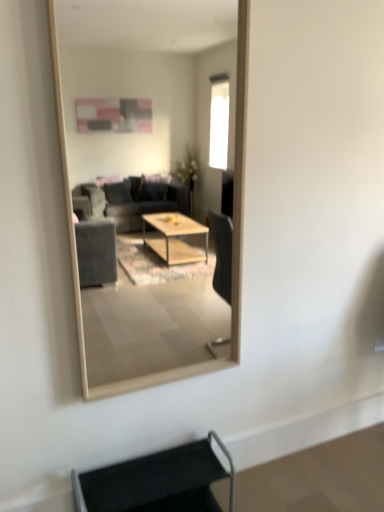
Question: From a real-world perspective, is black fabric armchair at lower center physically located above or below wooden frame mirror at center?

Choices:
 (A) below
 (B) above

Answer: (A)

Question: Does point (147, 487) appear closer or farther from the camera than point (84, 296)?

Choices:
 (A) farther
 (B) closer

Answer: (B)

Question: Relative to wooden frame mirror at center, is black fabric armchair at lower center in front or behind?

Choices:
 (A) behind
 (B) front

Answer: (A)

Question: Based on their positions, is wooden frame mirror at center located to the left or right of black fabric armchair at lower center?

Choices:
 (A) left
 (B) right

Answer: (B)

Question: In the image, is wooden frame mirror at center positioned in front of or behind black fabric armchair at lower center?

Choices:
 (A) behind
 (B) front

Answer: (B)

Question: In terms of width, does wooden frame mirror at center look wider or thinner when compared to black fabric armchair at lower center?

Choices:
 (A) thin
 (B) wide

Answer: (A)

Question: Do you think wooden frame mirror at center is within black fabric armchair at lower center, or outside of it?

Choices:
 (A) outside
 (B) inside

Answer: (A)